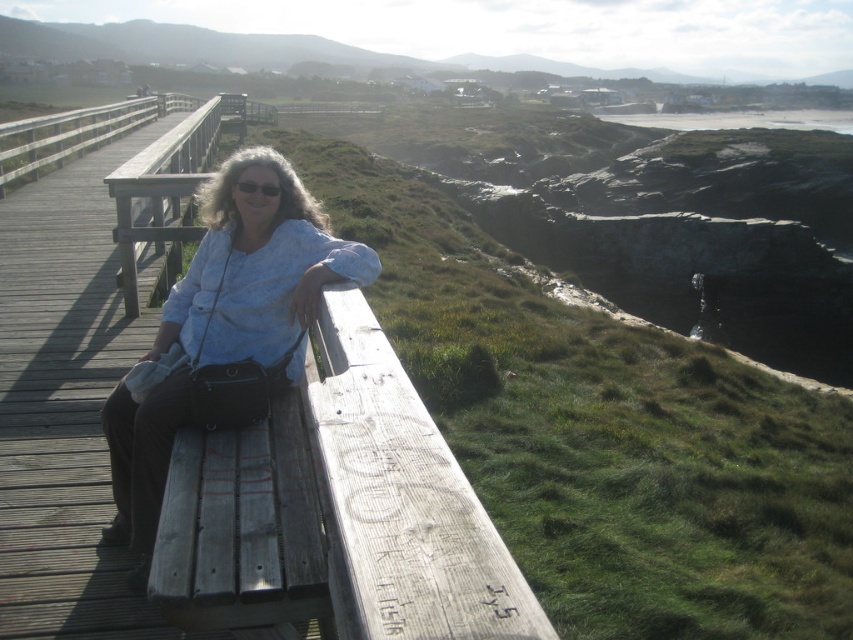
Is matte blue shirt at center to the left of wooden at left from the viewer's perspective?

No, matte blue shirt at center is not to the left of wooden at left.

Which is behind, point (218, 356) or point (177, 131)?

The point (177, 131) is more distant.

Image resolution: width=853 pixels, height=640 pixels. Find the location of `matte blue shirt at center`. matte blue shirt at center is located at coordinates (256, 269).

Looking at this image, is weathered wood bench at left taller than matte blue shirt at center?

In fact, weathered wood bench at left may be shorter than matte blue shirt at center.

Is point (294, 449) in front of point (248, 228)?

Yes, it is.

The width and height of the screenshot is (853, 640). What are the coordinates of `weathered wood bench at left` in the screenshot? It's located at (337, 512).

Is weathered wood bench at left thinner than wooden at left?

Yes, weathered wood bench at left is thinner than wooden at left.

At what (x,y) coordinates should I click in order to perform the action: click on weathered wood bench at left. Please return your answer as a coordinate pair (x, y). Image resolution: width=853 pixels, height=640 pixels. Looking at the image, I should click on (337, 512).

Where is `weathered wood bench at left`? weathered wood bench at left is located at coordinates (337, 512).

The width and height of the screenshot is (853, 640). I want to click on weathered wood bench at left, so click(337, 512).